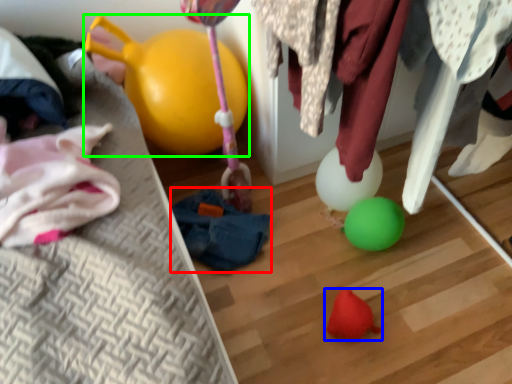
Question: Based on their relative distances, which object is nearer to bean bag chair (highlighted by a red box)? Choose from toy (highlighted by a blue box) and balloon (highlighted by a green box).

Choices:
 (A) toy
 (B) balloon

Answer: (B)